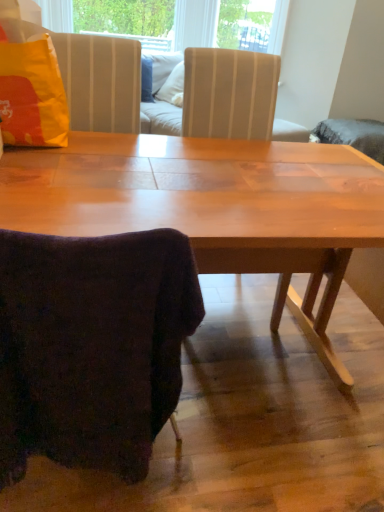
Question: Should I look upward or downward to see velvety dark purple chair at lower left?

Choices:
 (A) up
 (B) down

Answer: (B)

Question: From the image's perspective, does matte yellow pillow at upper left appear higher than velvety dark purple chair at lower left?

Choices:
 (A) no
 (B) yes

Answer: (B)

Question: Could you tell me if matte yellow pillow at upper left is facing velvety dark purple chair at lower left?

Choices:
 (A) yes
 (B) no

Answer: (B)

Question: Is matte yellow pillow at upper left not inside velvety dark purple chair at lower left?

Choices:
 (A) no
 (B) yes

Answer: (B)

Question: Does matte yellow pillow at upper left have a smaller size compared to velvety dark purple chair at lower left?

Choices:
 (A) no
 (B) yes

Answer: (B)

Question: Is matte yellow pillow at upper left in front of velvety dark purple chair at lower left?

Choices:
 (A) yes
 (B) no

Answer: (B)

Question: Is matte yellow pillow at upper left in contact with velvety dark purple chair at lower left?

Choices:
 (A) yes
 (B) no

Answer: (B)

Question: From the image's perspective, is velvety dark purple chair at lower left below matte yellow pillow at upper left?

Choices:
 (A) yes
 (B) no

Answer: (A)

Question: Can you confirm if velvety dark purple chair at lower left is shorter than matte yellow pillow at upper left?

Choices:
 (A) yes
 (B) no

Answer: (B)

Question: Is matte yellow pillow at upper left completely or partially inside velvety dark purple chair at lower left?

Choices:
 (A) yes
 (B) no

Answer: (B)

Question: From a real-world perspective, is velvety dark purple chair at lower left located higher than matte yellow pillow at upper left?

Choices:
 (A) no
 (B) yes

Answer: (A)

Question: Is velvety dark purple chair at lower left looking in the opposite direction of matte yellow pillow at upper left?

Choices:
 (A) no
 (B) yes

Answer: (A)

Question: Considering the relative positions of velvety dark purple chair at lower left and matte yellow pillow at upper left in the image provided, is velvety dark purple chair at lower left to the right of matte yellow pillow at upper left from the viewer's perspective?

Choices:
 (A) no
 (B) yes

Answer: (B)

Question: In terms of height, does matte yellow pillow at upper left look taller or shorter compared to velvety dark purple chair at lower left?

Choices:
 (A) tall
 (B) short

Answer: (B)